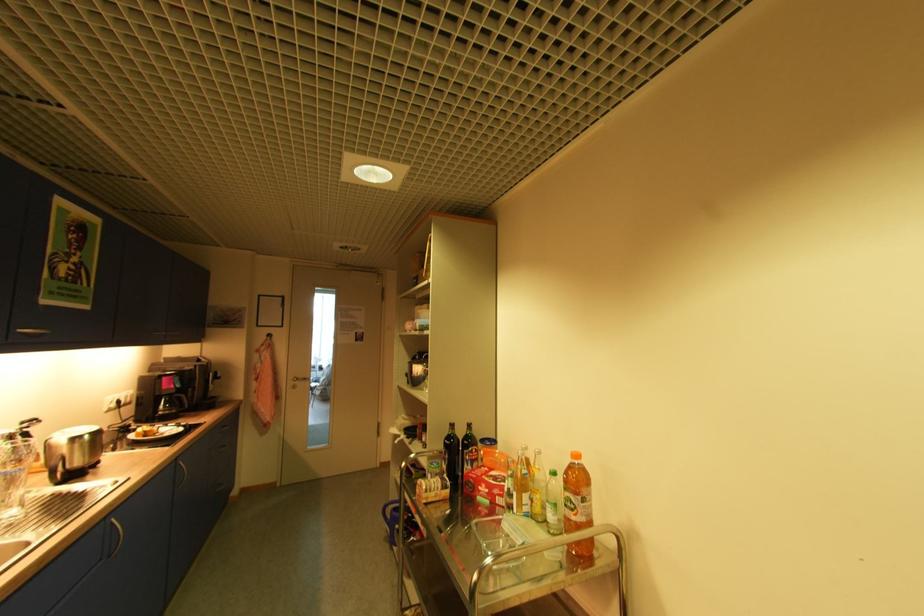
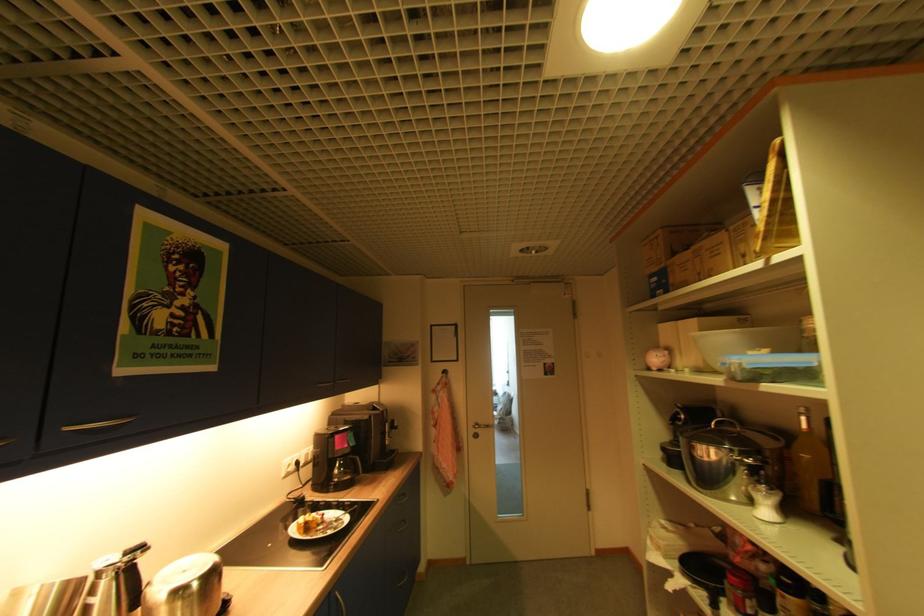
In the second image, find the point that corresponds to point 181,460 in the first image.

(335, 593)